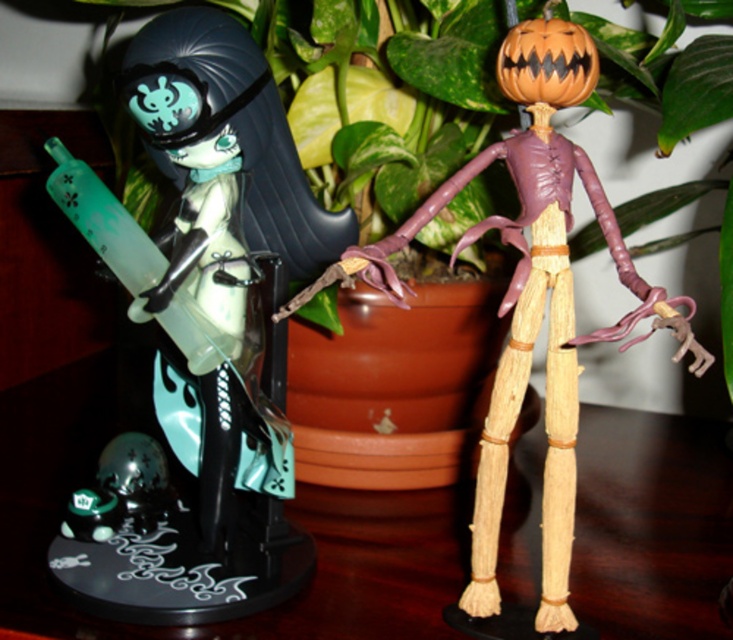
Question: Which object is farther from the camera taking this photo?

Choices:
 (A) wooden skeleton at right
 (B) matte green plastic figure at left

Answer: (B)

Question: Which object is closer to the camera taking this photo?

Choices:
 (A) matte green plastic figure at left
 (B) wooden skeleton at right

Answer: (B)

Question: Which object appears farthest from the camera in this image?

Choices:
 (A) wooden skeleton at right
 (B) matte green plastic figure at left

Answer: (B)

Question: Is matte green plastic figure at left smaller than wooden skeleton at right?

Choices:
 (A) no
 (B) yes

Answer: (A)

Question: Is matte green plastic figure at left to the left of wooden skeleton at right from the viewer's perspective?

Choices:
 (A) yes
 (B) no

Answer: (A)

Question: Observing the image, what is the correct spatial positioning of matte green plastic figure at left in reference to wooden skeleton at right?

Choices:
 (A) right
 (B) left

Answer: (B)